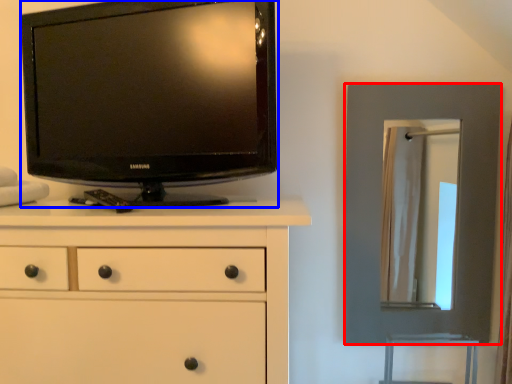
Question: Which of the following is the closest to the observer, picture frame (highlighted by a red box) or television (highlighted by a blue box)?

Choices:
 (A) picture frame
 (B) television

Answer: (B)